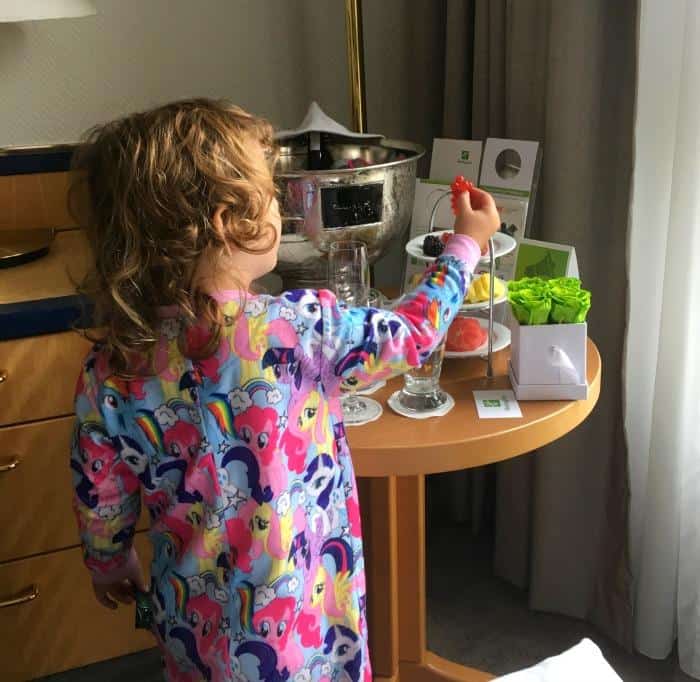
Locate an element on the screen. This screenshot has height=682, width=700. bowl is located at coordinates (400, 179).